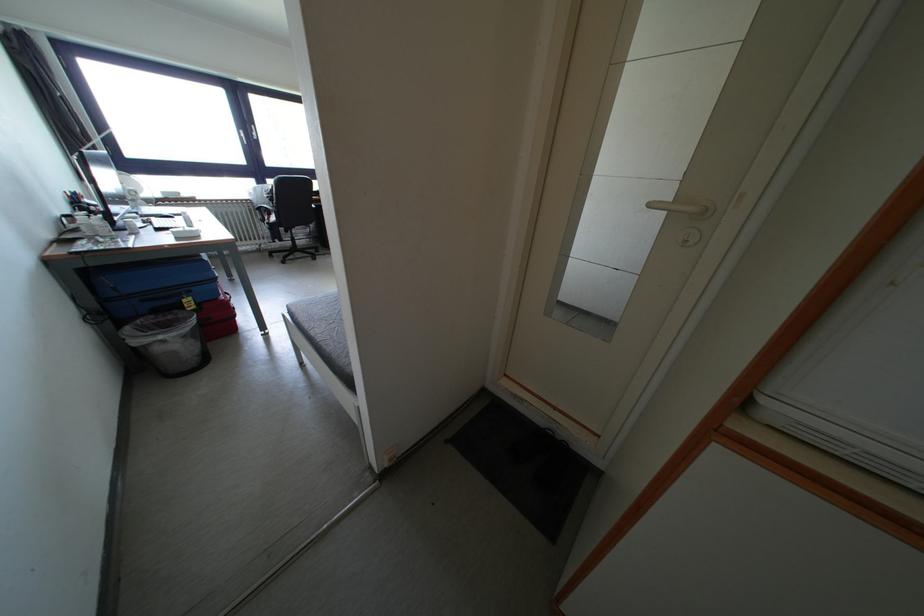
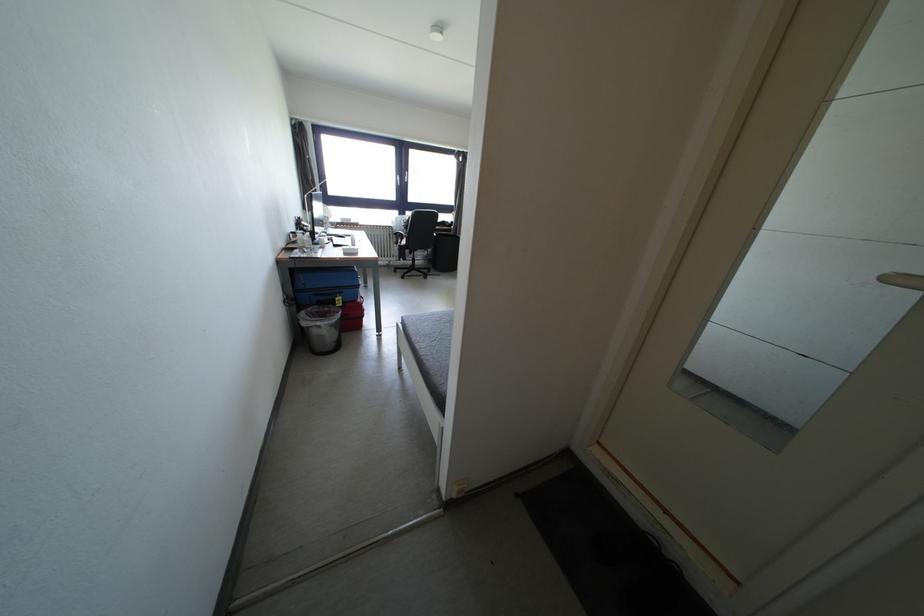
Locate, in the second image, the point that corresponds to pixel 167 342 in the first image.

(324, 328)